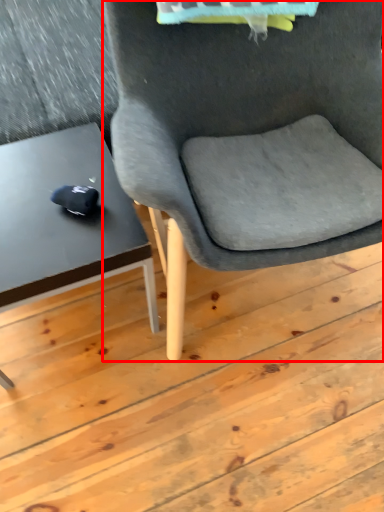
Question: From the image's perspective, what is the correct spatial positioning of chair (annotated by the red box) in reference to table?

Choices:
 (A) below
 (B) above

Answer: (B)